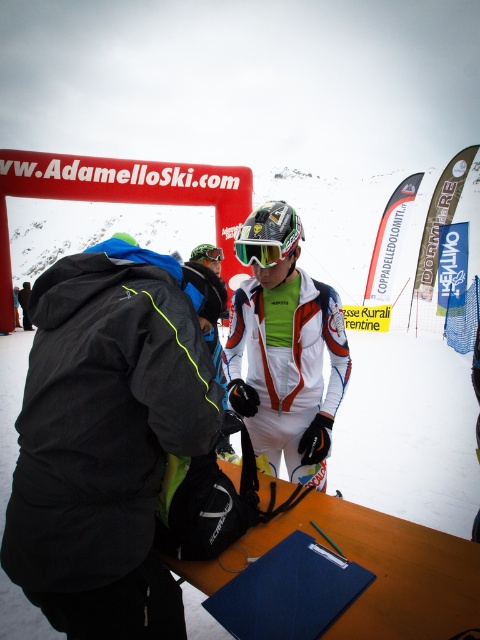
Is point (113, 384) positioned in front of point (211, 244)?

Yes, point (113, 384) is closer to viewer.

You are a GUI agent. You are given a task and a screenshot of the screen. Output one action in this format:
    pyautogui.click(x=<x>, y=<y>)
    Task: Click on the matte black jacket at center
    Image resolution: width=480 pixels, height=640 pixels.
    Given the screenshot: What is the action you would take?
    pyautogui.click(x=107, y=440)

At what (x,y) coordinates should I click in order to perform the action: click on matte black jacket at center. Please return your answer as a coordinate pair (x, y). The image size is (480, 640). Looking at the image, I should click on (107, 440).

Looking at this image, is white matte snowboarder at center further to camera compared to glossy plastic goggles at center?

Yes, white matte snowboarder at center is behind glossy plastic goggles at center.

This screenshot has width=480, height=640. Identify the location of white matte snowboarder at center. (285, 348).

Identify the location of white matte snowboarder at center. (285, 348).

Is glossy plastic goggles at center above green matte/glossy goggles at center?

No.

Who is shorter, glossy plastic goggles at center or green matte/glossy goggles at center?

With less height is glossy plastic goggles at center.

Does point (261, 266) come behind point (201, 244)?

No, it is not.

Where is `glossy plastic goggles at center`? The height and width of the screenshot is (640, 480). glossy plastic goggles at center is located at coordinates (263, 250).